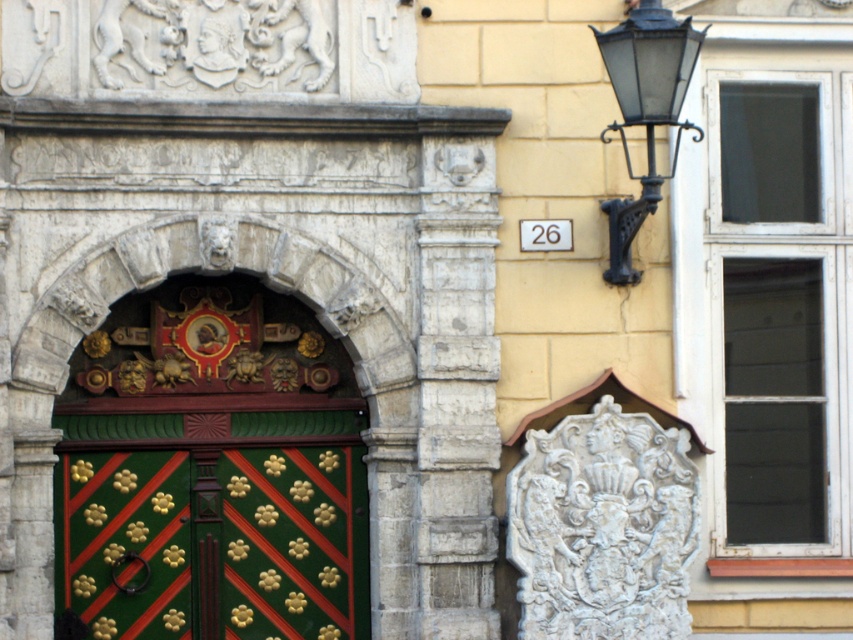
Question: Which object appears closest to the camera in this image?

Choices:
 (A) black wrought iron streetlamp at upper right
 (B) green painted wood door at center

Answer: (A)

Question: Which point is farther from the camera taking this photo?

Choices:
 (A) (228, 577)
 (B) (668, 84)

Answer: (A)

Question: Is green painted wood door at center above black wrought iron streetlamp at upper right?

Choices:
 (A) yes
 (B) no

Answer: (B)

Question: Which object is farther from the camera taking this photo?

Choices:
 (A) green painted wood door at center
 (B) black wrought iron streetlamp at upper right

Answer: (A)

Question: Can you confirm if green painted wood door at center is positioned to the right of black wrought iron streetlamp at upper right?

Choices:
 (A) yes
 (B) no

Answer: (B)

Question: Is green painted wood door at center thinner than black wrought iron streetlamp at upper right?

Choices:
 (A) yes
 (B) no

Answer: (B)